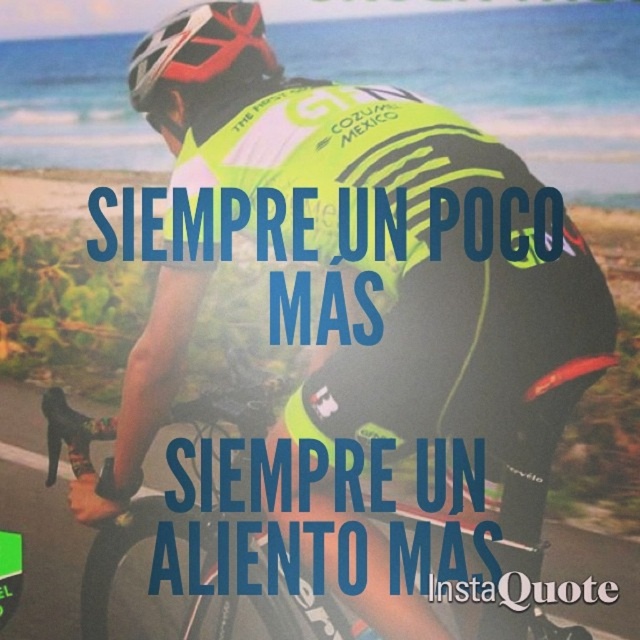
Question: Which object is closer to the camera taking this photo?

Choices:
 (A) matte black helmet at upper center
 (B) neon yellow fabric at center

Answer: (A)

Question: Does matte black helmet at upper center appear over neon yellow fabric at center?

Choices:
 (A) yes
 (B) no

Answer: (A)

Question: Is matte black helmet at upper center further to camera compared to neon yellow fabric at center?

Choices:
 (A) yes
 (B) no

Answer: (B)

Question: Can you confirm if matte black helmet at upper center is positioned to the right of neon yellow fabric at center?

Choices:
 (A) yes
 (B) no

Answer: (A)

Question: Which point is farther to the camera?

Choices:
 (A) matte black helmet at upper center
 (B) neon yellow fabric at center

Answer: (B)